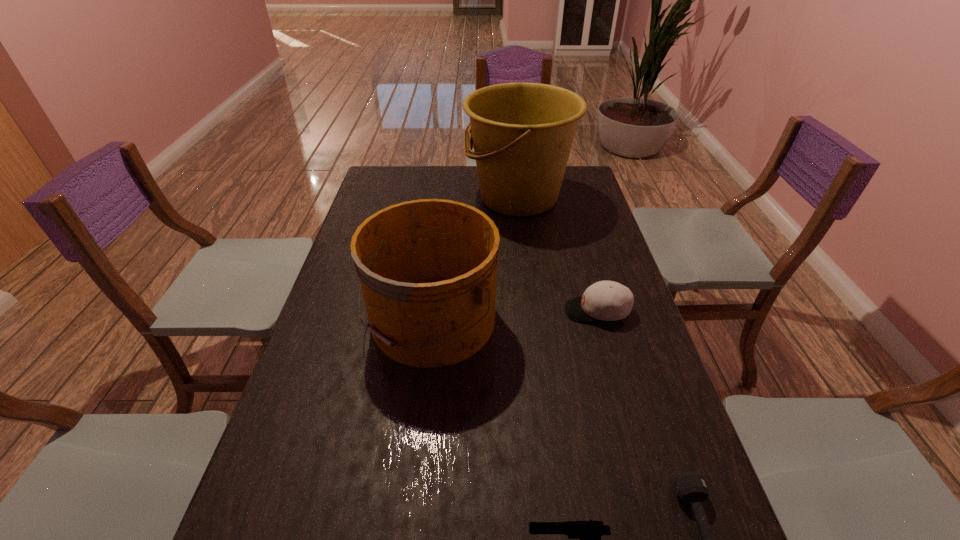
The image size is (960, 540). I want to click on free point located 0.070m on the front-facing side of the baseball cap, so click(540, 310).

Locate an element on the screen. This screenshot has width=960, height=540. vacant space located 0.180m on the front-facing side of the baseball cap is located at coordinates (502, 310).

Image resolution: width=960 pixels, height=540 pixels. What are the coordinates of `object at the far edge` in the screenshot? It's located at (522, 132).

The height and width of the screenshot is (540, 960). Identify the location of object situated at the left edge. (427, 268).

This screenshot has width=960, height=540. I want to click on bucket located at the right edge, so click(x=522, y=132).

What are the coordinates of `baseball cap that is positioned at the right edge` in the screenshot? It's located at (605, 300).

Image resolution: width=960 pixels, height=540 pixels. In order to click on object that is positioned at the far right corner in this screenshot , I will do `click(522, 132)`.

I want to click on vacant point at the left edge, so click(x=372, y=210).

At what (x,y) coordinates should I click in order to perform the action: click on vacant space at the right edge of the desktop. Please return your answer as a coordinate pair (x, y). The width and height of the screenshot is (960, 540). Looking at the image, I should click on (592, 356).

I want to click on vacant space at the far right corner, so click(582, 185).